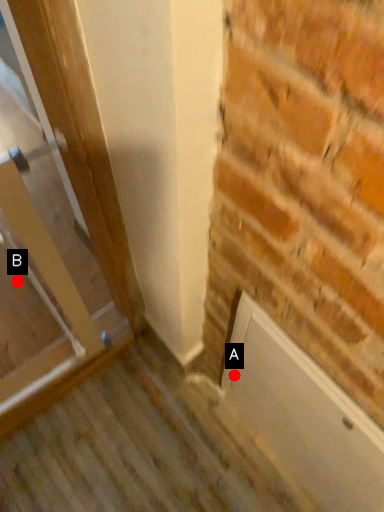
Question: Two points are circled on the image, labeled by A and B beside each circle. Which of the following is the closest to the observer?

Choices:
 (A) A is closer
 (B) B is closer

Answer: (A)